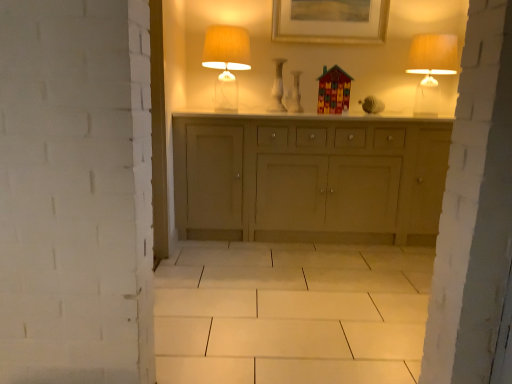
Locate an element on the screen. Image resolution: width=512 pixels, height=384 pixels. matte cream table lamp at upper right, which appears as the second table lamp when viewed from the left is located at coordinates tap(431, 68).

Is translucent glass table lamp at upper center, marked as the 1th table lamp in a left-to-right arrangement, shorter than white glossy vase at center?

No.

Does point (231, 80) come closer to viewer compared to point (281, 93)?

Yes, it is.

Considering the sizes of translucent glass table lamp at upper center, which is the second table lamp in right-to-left order, and white glossy vase at center in the image, is translucent glass table lamp at upper center, which is the second table lamp in right-to-left order, bigger or smaller than white glossy vase at center?

translucent glass table lamp at upper center, which is the second table lamp in right-to-left order, is bigger than white glossy vase at center.

Which is more to the left, translucent glass table lamp at upper center, marked as the 1th table lamp in a left-to-right arrangement, or white glossy vase at center?

translucent glass table lamp at upper center, marked as the 1th table lamp in a left-to-right arrangement.

Is gold-framed picture at upper center beside matte cream table lamp at upper right, which appears as the second table lamp when viewed from the left?

gold-framed picture at upper center and matte cream table lamp at upper right, which appears as the second table lamp when viewed from the left, are not in contact.

In the image, there is a matte cream table lamp at upper right, which appears as the second table lamp when viewed from the left. Where is `picture frame above it (from the image's perspective)`? Image resolution: width=512 pixels, height=384 pixels. picture frame above it (from the image's perspective) is located at coordinates (330, 21).

Consider the image. Is gold-framed picture at upper center facing towards matte cream table lamp at upper right, which appears as the second table lamp when viewed from the left?

No, gold-framed picture at upper center is not facing towards matte cream table lamp at upper right, which appears as the second table lamp when viewed from the left.

From a real-world perspective, which object rests below the other?

matte cream table lamp at upper right, the 1th table lamp from the right, from a real-world perspective.

In the scene shown: Is matte cream table lamp at upper right, which appears as the second table lamp when viewed from the left, closer to the viewer compared to white glossy vase at center?

Yes, matte cream table lamp at upper right, which appears as the second table lamp when viewed from the left, is closer to the viewer.

Considering the sizes of objects matte cream table lamp at upper right, the 1th table lamp from the right, and white glossy vase at center in the image provided, who is bigger, matte cream table lamp at upper right, the 1th table lamp from the right, or white glossy vase at center?

With larger size is matte cream table lamp at upper right, the 1th table lamp from the right.

Considering the sizes of matte cream table lamp at upper right, which appears as the second table lamp when viewed from the left, and white glossy vase at center in the image, is matte cream table lamp at upper right, which appears as the second table lamp when viewed from the left, taller or shorter than white glossy vase at center?

matte cream table lamp at upper right, which appears as the second table lamp when viewed from the left, is taller than white glossy vase at center.

In the scene shown: Looking at their sizes, would you say matte cream table lamp at upper right, which appears as the second table lamp when viewed from the left, is wider or thinner than white glossy vase at center?

matte cream table lamp at upper right, which appears as the second table lamp when viewed from the left, is wider than white glossy vase at center.

Can you confirm if matte cream table lamp at upper right, which appears as the second table lamp when viewed from the left, is bigger than translucent glass table lamp at upper center, marked as the 1th table lamp in a left-to-right arrangement?

Actually, matte cream table lamp at upper right, which appears as the second table lamp when viewed from the left, might be smaller than translucent glass table lamp at upper center, marked as the 1th table lamp in a left-to-right arrangement.

Considering the positions of points (443, 58) and (229, 31), is point (443, 58) closer to camera compared to point (229, 31)?

Yes, point (443, 58) is in front of point (229, 31).

Based on the photo, considering the positions of objects matte cream table lamp at upper right, which appears as the second table lamp when viewed from the left, and translucent glass table lamp at upper center, marked as the 1th table lamp in a left-to-right arrangement, in the image provided, who is more to the right, matte cream table lamp at upper right, which appears as the second table lamp when viewed from the left, or translucent glass table lamp at upper center, marked as the 1th table lamp in a left-to-right arrangement,?

matte cream table lamp at upper right, which appears as the second table lamp when viewed from the left, is more to the right.

From the image's perspective, is white glossy vase at center over gold-framed picture at upper center?

No, from the image's perspective, white glossy vase at center is not on top of gold-framed picture at upper center.

You are a GUI agent. You are given a task and a screenshot of the screen. Output one action in this format:
    pyautogui.click(x=<x>, y=<y>)
    Task: Click on the vase that appears below the gold-framed picture at upper center (from the image's perspective)
    
    Given the screenshot: What is the action you would take?
    pyautogui.click(x=277, y=88)

Would you say white glossy vase at center is outside gold-framed picture at upper center?

white glossy vase at center lies outside gold-framed picture at upper center's area.

Can you confirm if white glossy vase at center is wider than translucent glass table lamp at upper center, marked as the 1th table lamp in a left-to-right arrangement?

Incorrect, the width of white glossy vase at center does not surpass that of translucent glass table lamp at upper center, marked as the 1th table lamp in a left-to-right arrangement.

Measure the distance between white glossy vase at center and translucent glass table lamp at upper center, which is the second table lamp in right-to-left order.

white glossy vase at center is 16.01 inches away from translucent glass table lamp at upper center, which is the second table lamp in right-to-left order.

Does point (279, 89) appear closer or farther from the camera than point (207, 52)?

Clearly, point (279, 89) is more distant from the camera than point (207, 52).

From a real-world perspective, between matte cream table lamp at upper right, the 1th table lamp from the right, and gold-framed picture at upper center, who is vertically lower?

matte cream table lamp at upper right, the 1th table lamp from the right.

Is matte cream table lamp at upper right, which appears as the second table lamp when viewed from the left, to the left or to the right of gold-framed picture at upper center in the image?

In the image, matte cream table lamp at upper right, which appears as the second table lamp when viewed from the left, appears on the right side of gold-framed picture at upper center.

From the image's perspective, is matte cream table lamp at upper right, which appears as the second table lamp when viewed from the left, over gold-framed picture at upper center?

Incorrect, from the image's perspective, matte cream table lamp at upper right, which appears as the second table lamp when viewed from the left, is lower than gold-framed picture at upper center.

How different are the orientations of matte cream table lamp at upper right, which appears as the second table lamp when viewed from the left, and gold-framed picture at upper center in degrees?

There is a 0.591-degree angle between the facing directions of matte cream table lamp at upper right, which appears as the second table lamp when viewed from the left, and gold-framed picture at upper center.

The width and height of the screenshot is (512, 384). I want to click on vase below the translucent glass table lamp at upper center, which is the second table lamp in right-to-left order (from the image's perspective), so click(277, 88).

Where is `the 1st table lamp below the gold-framed picture at upper center (from a real-world perspective)`? the 1st table lamp below the gold-framed picture at upper center (from a real-world perspective) is located at coordinates (431, 68).

Based on their spatial positions, is gold-framed picture at upper center or translucent glass table lamp at upper center, marked as the 1th table lamp in a left-to-right arrangement, further from matte cream table lamp at upper right, which appears as the second table lamp when viewed from the left?

The object further to matte cream table lamp at upper right, which appears as the second table lamp when viewed from the left, is translucent glass table lamp at upper center, marked as the 1th table lamp in a left-to-right arrangement.

Based on their spatial positions, is translucent glass table lamp at upper center, which is the second table lamp in right-to-left order, or matte cream table lamp at upper right, the 1th table lamp from the right, closer to gold-framed picture at upper center?

translucent glass table lamp at upper center, which is the second table lamp in right-to-left order, is positioned closer to the anchor gold-framed picture at upper center.

Considering their positions, is white glossy vase at center positioned closer to matte cream table lamp at upper right, which appears as the second table lamp when viewed from the left, than translucent glass table lamp at upper center, which is the second table lamp in right-to-left order?

Among the two, white glossy vase at center is located nearer to matte cream table lamp at upper right, which appears as the second table lamp when viewed from the left.

Estimate the real-world distances between objects in this image. Which object is closer to matte cream table lamp at upper right, which appears as the second table lamp when viewed from the left, gold-framed picture at upper center or white glossy vase at center?

The object closer to matte cream table lamp at upper right, which appears as the second table lamp when viewed from the left, is gold-framed picture at upper center.

When comparing their distances from gold-framed picture at upper center, does translucent glass table lamp at upper center, which is the second table lamp in right-to-left order, or white glossy vase at center seem closer?

white glossy vase at center.

Estimate the real-world distances between objects in this image. Which object is further from white glossy vase at center, matte cream table lamp at upper right, which appears as the second table lamp when viewed from the left, or translucent glass table lamp at upper center, marked as the 1th table lamp in a left-to-right arrangement?

The object further to white glossy vase at center is matte cream table lamp at upper right, which appears as the second table lamp when viewed from the left.

Looking at the image, which one is located further to translucent glass table lamp at upper center, which is the second table lamp in right-to-left order, matte cream table lamp at upper right, the 1th table lamp from the right, or gold-framed picture at upper center?

matte cream table lamp at upper right, the 1th table lamp from the right.

Estimate the real-world distances between objects in this image. Which object is further from white glossy vase at center, translucent glass table lamp at upper center, marked as the 1th table lamp in a left-to-right arrangement, or gold-framed picture at upper center?

gold-framed picture at upper center lies further to white glossy vase at center than the other object.

Locate an element on the screen. vase located between translucent glass table lamp at upper center, which is the second table lamp in right-to-left order, and matte cream table lamp at upper right, the 1th table lamp from the right, in the left-right direction is located at coordinates (277, 88).

This screenshot has height=384, width=512. Find the location of `picture frame located between white glossy vase at center and matte cream table lamp at upper right, the 1th table lamp from the right, in the left-right direction`. picture frame located between white glossy vase at center and matte cream table lamp at upper right, the 1th table lamp from the right, in the left-right direction is located at coordinates (330, 21).

Locate an element on the screen. This screenshot has height=384, width=512. picture frame between translucent glass table lamp at upper center, which is the second table lamp in right-to-left order, and matte cream table lamp at upper right, which appears as the second table lamp when viewed from the left is located at coordinates (330, 21).

Find the location of a particular element. This screenshot has width=512, height=384. vase located between translucent glass table lamp at upper center, which is the second table lamp in right-to-left order, and gold-framed picture at upper center in the left-right direction is located at coordinates (277, 88).